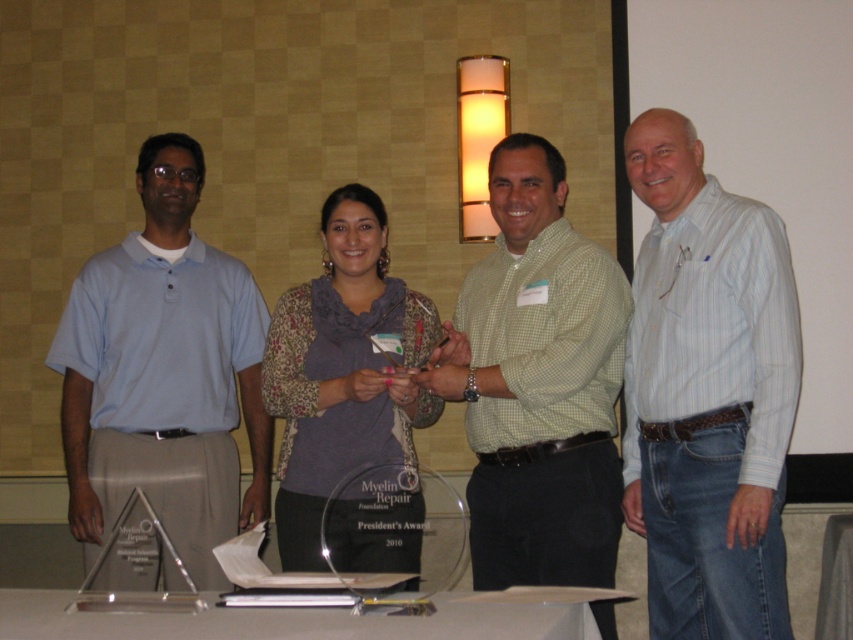
You are standing at the entrance of the conference room and see two points marked in the image. The first point is at coordinates point (546, 253) and the second point is at point (57, 589). Which point is closer to the entrance?

Point (57, 589) is closer to the entrance because it is in front of point (546, 253).